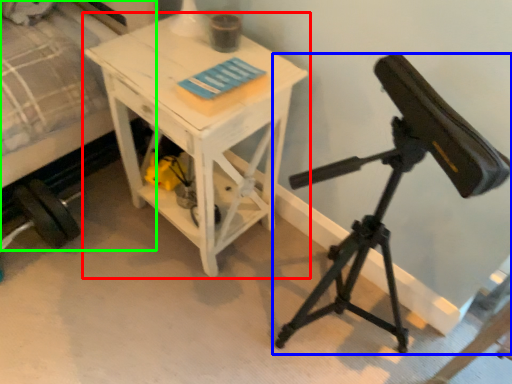
Question: Which is nearer to the table (highlighted by a red box)? tripod (highlighted by a blue box) or bed (highlighted by a green box).

Choices:
 (A) tripod
 (B) bed

Answer: (B)